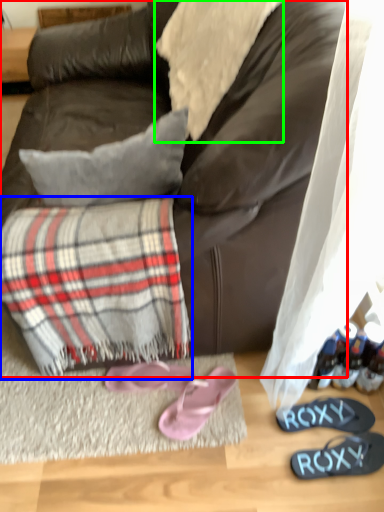
Question: Which object is positioned closest to studio couch (highlighted by a red box)? Select from flannel (highlighted by a blue box) and cloth (highlighted by a green box).

Choices:
 (A) flannel
 (B) cloth

Answer: (B)